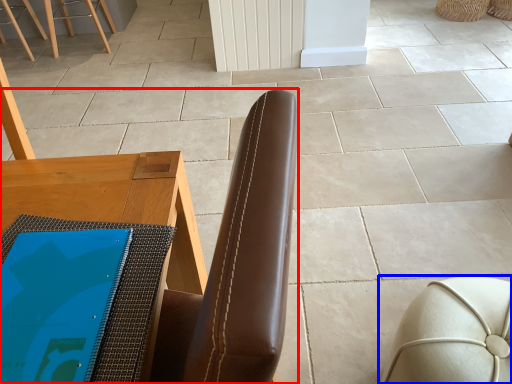
Question: Which object appears farthest to the camera in this image, chair (highlighted by a red box) or furniture (highlighted by a blue box)?

Choices:
 (A) chair
 (B) furniture

Answer: (B)